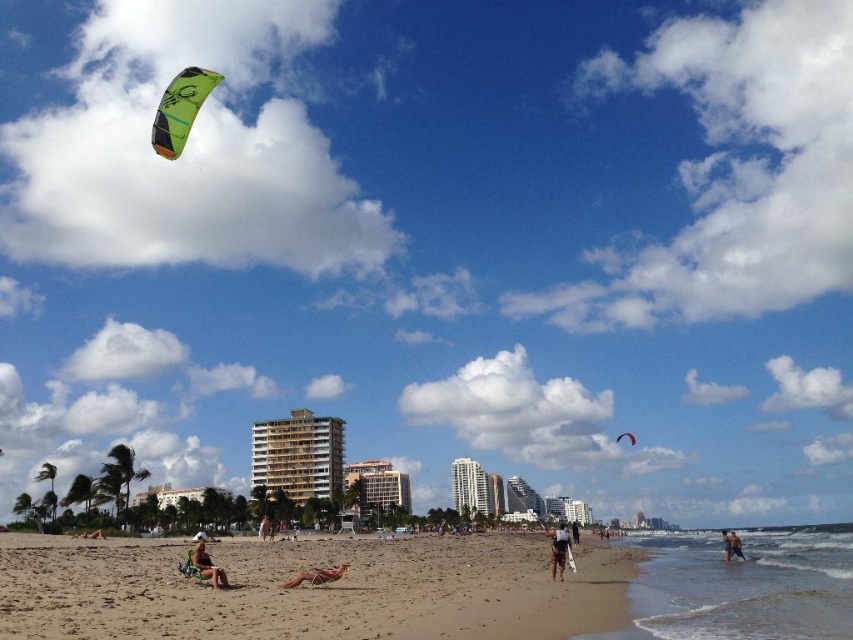
Question: Which of the following is the farthest from the observer?

Choices:
 (A) green fabric parachute at upper center
 (B) white fabric surfboard at lower right
 (C) gold textured building at center

Answer: (A)

Question: From the image, what is the correct spatial relationship of brown sandy beach at lower center in relation to tan leather chair at lower center?

Choices:
 (A) right
 (B) left

Answer: (B)

Question: Is brown sandy beach at lower center thinner than dark blue fabric shorts at lower center?

Choices:
 (A) yes
 (B) no

Answer: (B)

Question: Which object appears farthest from the camera in this image?

Choices:
 (A) green fabric parachute at upper center
 (B) dark blue fabric shorts at lower center
 (C) brown sandy beach at lower center
 (D) white fabric surfboard at lower right

Answer: (A)

Question: Which point appears farthest from the camera in this image?

Choices:
 (A) (560, 528)
 (B) (335, 564)

Answer: (A)

Question: Can you confirm if gold textured building at center is positioned above green fabric parachute at upper center?

Choices:
 (A) yes
 (B) no

Answer: (A)